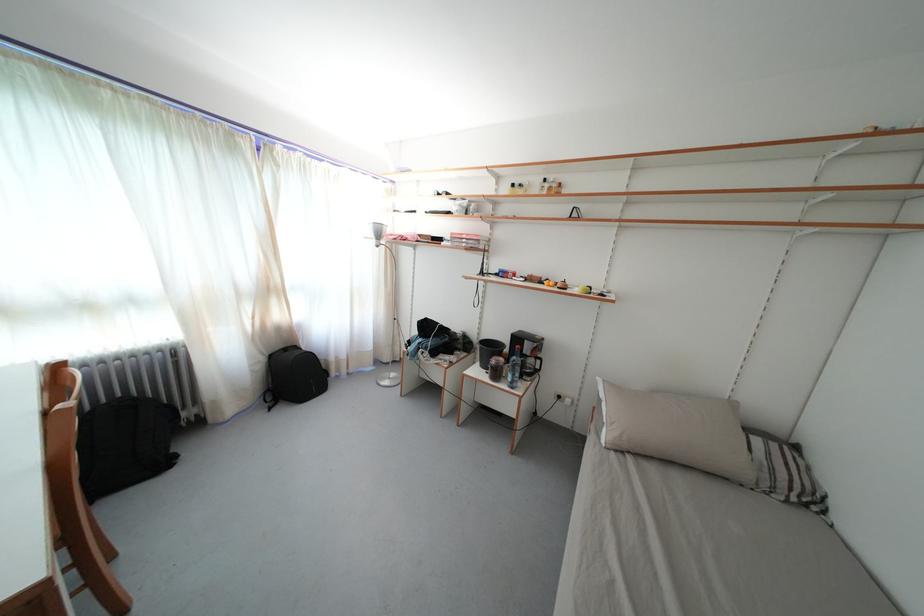
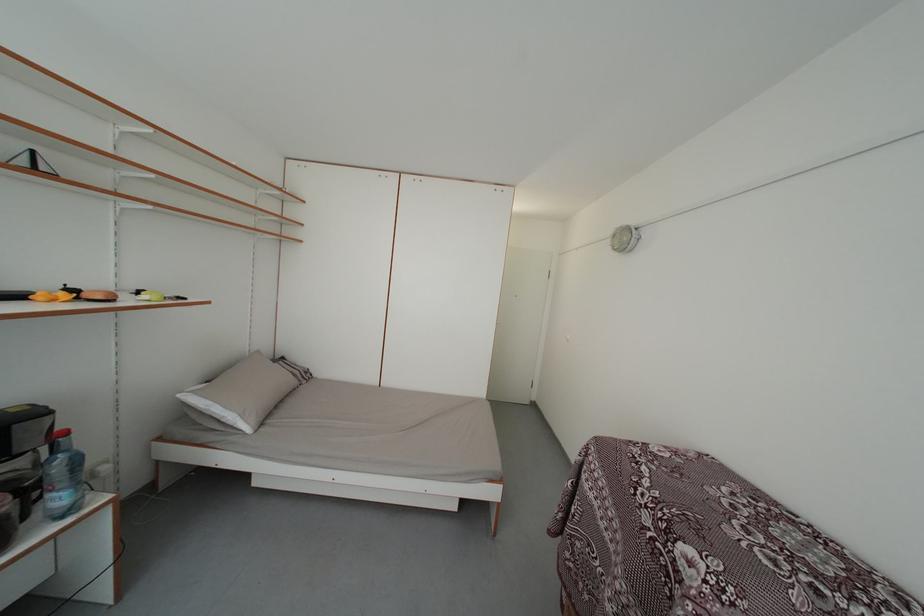
The point at (x=803, y=454) is marked in the first image. Where is the corresponding point in the second image?

(289, 365)